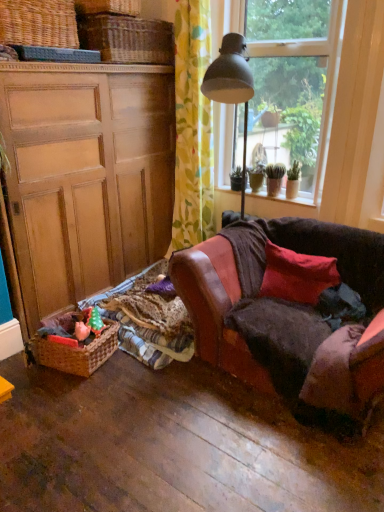
Image resolution: width=384 pixels, height=512 pixels. Describe the element at coordinates (293, 80) in the screenshot. I see `clear glass window at upper right` at that location.

Locate an element on the screen. The height and width of the screenshot is (512, 384). woven brown picnic basket at lower left, placed as the 2th picnic basket when sorted from top to bottom is located at coordinates (77, 353).

The width and height of the screenshot is (384, 512). What do you see at coordinates (277, 203) in the screenshot?
I see `smooth concrete window sill at center` at bounding box center [277, 203].

Locate an element on the screen. woven brown basket at upper left, marked as the 2th basket in a front-to-back arrangement is located at coordinates (127, 39).

Choose the correct answer: Is clear glass window at upper right inside woven brown picnic basket at upper left, which is counted as the 2th picnic basket, starting from the bottom, or outside it?

clear glass window at upper right is not inside woven brown picnic basket at upper left, which is counted as the 2th picnic basket, starting from the bottom, it's outside.

Consider the image. Is clear glass window at upper right positioned with its back to woven brown picnic basket at upper left, which is counted as the 2th picnic basket, starting from the bottom?

clear glass window at upper right does not have its back to woven brown picnic basket at upper left, which is counted as the 2th picnic basket, starting from the bottom.

Which point is more forward, (329, 64) or (60, 39)?

Positioned in front is point (60, 39).

From the image's perspective, who appears lower, clear glass window at upper right or woven brown picnic basket at upper left, which is counted as the 2th picnic basket, starting from the bottom?

From the image's view, clear glass window at upper right is below.

From the picture: Which of these two, woven brown picnic basket at lower left, which is counted as the 1th picnic basket, starting from the bottom, or smooth concrete window sill at center, is thinner?

Thinner between the two is smooth concrete window sill at center.

From the image's perspective, is woven brown picnic basket at lower left, placed as the 2th picnic basket when sorted from top to bottom, located above or below smooth concrete window sill at center?

Based on their image positions, woven brown picnic basket at lower left, placed as the 2th picnic basket when sorted from top to bottom, is located beneath smooth concrete window sill at center.

Is woven brown picnic basket at lower left, which is counted as the 1th picnic basket, starting from the bottom, touching smooth concrete window sill at center?

No.

Which of these two, woven brown picnic basket at lower left, which is counted as the 1th picnic basket, starting from the bottom, or smooth concrete window sill at center, is smaller?

smooth concrete window sill at center is smaller.

Which object is closer to the camera taking this photo, green matte plant at window, the second houseplant viewed from the right, or woven wicker basket at upper left, positioned as the first basket in front-to-back order?

woven wicker basket at upper left, positioned as the first basket in front-to-back order, is in front.

This screenshot has height=512, width=384. Identify the location of the 1st houseplant to the right of the woven wicker basket at upper left, positioned as the first basket in front-to-back order, starting your count from the anchor. (274, 178).

From the image's perspective, between green matte plant at window, the first houseplant from the left, and woven wicker basket at upper left, positioned as the first basket in front-to-back order, which one is located above?

woven wicker basket at upper left, positioned as the first basket in front-to-back order, appears higher in the image.

How much distance is there between green matte plant at window, the second houseplant viewed from the right, and woven wicker basket at upper left, arranged as the second basket when viewed from the back?

The distance of green matte plant at window, the second houseplant viewed from the right, from woven wicker basket at upper left, arranged as the second basket when viewed from the back, is 1.56 meters.

Consider the image. Between floral fabric curtain at upper center and leather couch at right, which one has more height?

floral fabric curtain at upper center is taller.

Between floral fabric curtain at upper center and leather couch at right, which one has smaller width?

floral fabric curtain at upper center is thinner.

Is point (181, 234) behind point (341, 343)?

Yes.

Which is behind, floral fabric curtain at upper center or leather couch at right?

floral fabric curtain at upper center is further away from the camera.

Is plaid fabric blanket at lower left next to clear glass window at upper right?

No, plaid fabric blanket at lower left is not with clear glass window at upper right.

Based on the photo, from a real-world perspective, is plaid fabric blanket at lower left positioned over clear glass window at upper right based on gravity?

No, from a real-world perspective, plaid fabric blanket at lower left is not on top of clear glass window at upper right.

Does plaid fabric blanket at lower left have a lesser width compared to clear glass window at upper right?

No, plaid fabric blanket at lower left is not thinner than clear glass window at upper right.

Which is more to the left, red velvet cushion at center or plaid fabric blanket at lower left?

plaid fabric blanket at lower left is more to the left.

From a real-world perspective, between red velvet cushion at center and plaid fabric blanket at lower left, who is vertically higher?

red velvet cushion at center, from a real-world perspective.

Which of these two, red velvet cushion at center or plaid fabric blanket at lower left, stands taller?

red velvet cushion at center is taller.

Does point (284, 249) lie behind point (317, 114)?

No, (284, 249) is closer to viewer.

Is red velvet cushion at center beside clear glass window at upper right?

red velvet cushion at center and clear glass window at upper right are not in contact.

Is red velvet cushion at center not inside clear glass window at upper right?

Indeed, red velvet cushion at center is completely outside clear glass window at upper right.

From a real-world perspective, does red velvet cushion at center stand above clear glass window at upper right?

No.

Starting from the clear glass window at upper right, which picnic basket is the 2nd one to the left? Please provide its 2D coordinates.

[(38, 23)]

Find the location of a particular element. window sill on the right of woven brown picnic basket at lower left, placed as the 2th picnic basket when sorted from top to bottom is located at coordinates (277, 203).

When comparing their distances from matte wood cabinet at left, does clear glass window at upper right or green matte plant at window, positioned as the second houseplant in left-to-right order, seem further?

The object further to matte wood cabinet at left is clear glass window at upper right.

Considering their positions, is leather couch at right positioned closer to green matte plant at window, positioned as the second houseplant in left-to-right order, than matte wood cabinet at left?

leather couch at right.

From the image, which object appears to be farther from clear glass window at upper right, leather couch at right or woven brown picnic basket at lower left, which is counted as the 1th picnic basket, starting from the bottom?

Based on the image, woven brown picnic basket at lower left, which is counted as the 1th picnic basket, starting from the bottom, appears to be further to clear glass window at upper right.

Which object lies further to the anchor point floral fabric curtain at upper center, matte wood cabinet at left or plaid fabric blanket at lower left?

Among the two, plaid fabric blanket at lower left is located further to floral fabric curtain at upper center.

Based on their spatial positions, is leather couch at right or woven brown picnic basket at lower left, which is counted as the 1th picnic basket, starting from the bottom, closer to floral fabric curtain at upper center?

Based on the image, leather couch at right appears to be nearer to floral fabric curtain at upper center.

Looking at the image, which one is located closer to green matte plant at window, positioned as the second houseplant in left-to-right order, woven brown picnic basket at upper left, the 1th picnic basket positioned from the top, or green matte plant at window, the second houseplant viewed from the right?

green matte plant at window, the second houseplant viewed from the right, is positioned closer to the anchor green matte plant at window, positioned as the second houseplant in left-to-right order.

Which object lies further to the anchor point floral fabric curtain at upper center, red velvet cushion at center or woven brown picnic basket at upper left, which is counted as the 2th picnic basket, starting from the bottom?

Based on the image, woven brown picnic basket at upper left, which is counted as the 2th picnic basket, starting from the bottom, appears to be further to floral fabric curtain at upper center.

Looking at the image, which one is located further to woven brown basket at upper left, which is counted as the first basket, starting from the back, leather couch at right or woven wicker basket at upper left, arranged as the second basket when viewed from the back?

Among the two, leather couch at right is located further to woven brown basket at upper left, which is counted as the first basket, starting from the back.

Find the location of `window sill located between red velvet cushion at center and green matte plant at window, positioned as the second houseplant in left-to-right order, in the depth direction`. window sill located between red velvet cushion at center and green matte plant at window, positioned as the second houseplant in left-to-right order, in the depth direction is located at coordinates (277, 203).

Find the location of a particular element. This screenshot has width=384, height=512. window sill between green matte plant at window, positioned as the second houseplant in left-to-right order, and plaid fabric blanket at lower left, in the vertical direction is located at coordinates (277, 203).

Identify the location of curtain that lies between clear glass window at upper right and woven brown picnic basket at lower left, placed as the 2th picnic basket when sorted from top to bottom, from top to bottom. (192, 127).

Locate an element on the screen. This screenshot has height=512, width=384. window sill between matte wood cabinet at left and red velvet cushion at center from left to right is located at coordinates (277, 203).